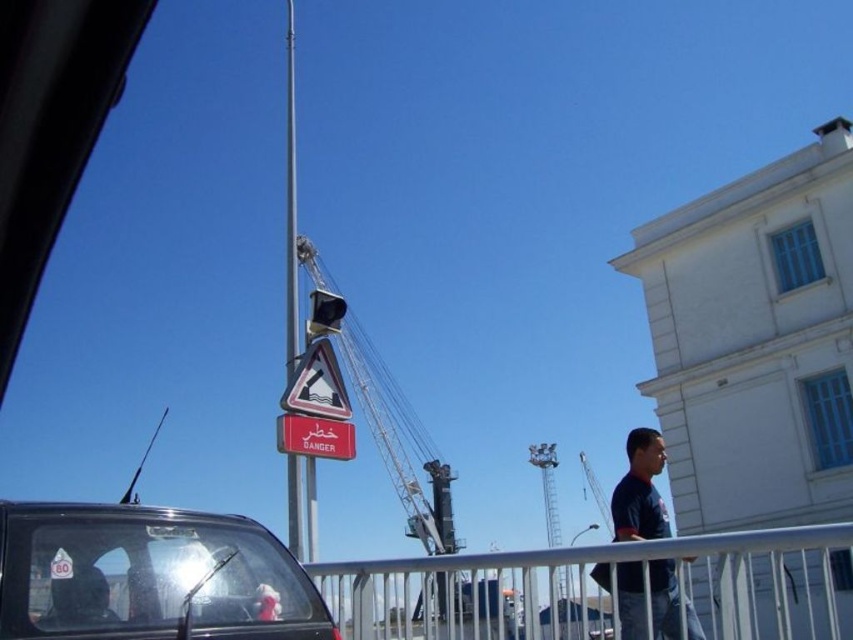
You are standing at the port and notice a clear glass car at lower left. Where exactly is this car positioned in relation to the red danger sign and the traffic light on the pole?

The clear glass car at lower left is located at point (149, 576), which places it near the lower left corner of the scene, close to the base of the pole with the red danger sign and traffic light.

You are a delivery driver approaching the port area and notice a white metallic rail at center and a metallic gray crane at center. Which object is closer to you as you drive towards them?

The white metallic rail at center is closer to you because it is in front of the metallic gray crane at center.